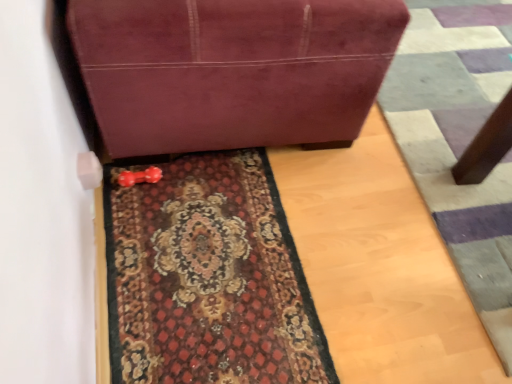
Where is `free space to the right of suede-like maroon sofa at upper center`? The image size is (512, 384). free space to the right of suede-like maroon sofa at upper center is located at coordinates (444, 109).